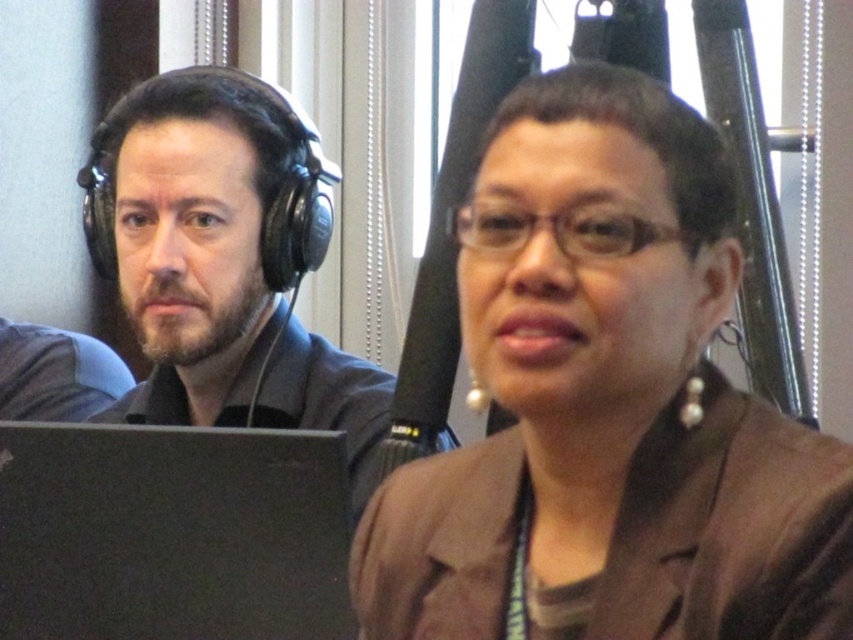
Is matte black headphones at left to the right of black matte laptop at lower left from the viewer's perspective?

Yes, matte black headphones at left is to the right of black matte laptop at lower left.

Find the location of a particular element. matte black headphones at left is located at coordinates (198, 401).

Who is more distant from viewer, (114, 227) or (9, 595)?

Positioned behind is point (114, 227).

Locate an element on the screen. The height and width of the screenshot is (640, 853). matte black headphones at left is located at coordinates (198, 401).

Is brown fabric jacket at center to the right of black matte laptop at lower left from the viewer's perspective?

Indeed, brown fabric jacket at center is positioned on the right side of black matte laptop at lower left.

In the scene shown: Does brown fabric jacket at center have a smaller size compared to black matte laptop at lower left?

Actually, brown fabric jacket at center might be larger than black matte laptop at lower left.

Between point (787, 468) and point (132, 429), which one is positioned behind?

The point (132, 429) is more distant.

At what (x,y) coordinates should I click in order to perform the action: click on brown fabric jacket at center. Please return your answer as a coordinate pair (x, y). Image resolution: width=853 pixels, height=640 pixels. Looking at the image, I should click on (607, 404).

Is brown fabric jacket at center wider than matte black headphones at left?

Incorrect, brown fabric jacket at center's width does not surpass matte black headphones at left's.

Between point (709, 173) and point (91, 483), which one is positioned behind?

The point (91, 483) is more distant.

Locate an element on the screen. This screenshot has height=640, width=853. brown fabric jacket at center is located at coordinates (607, 404).